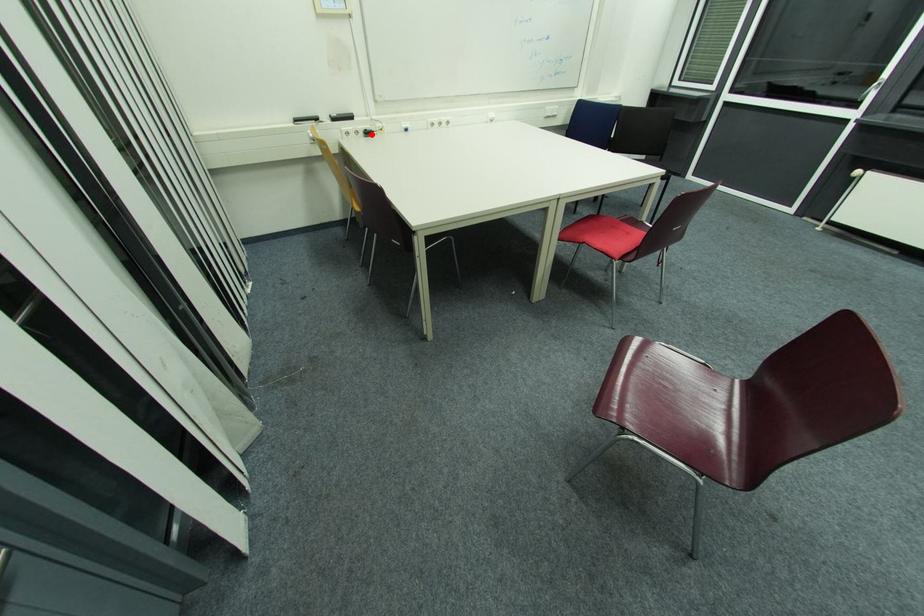
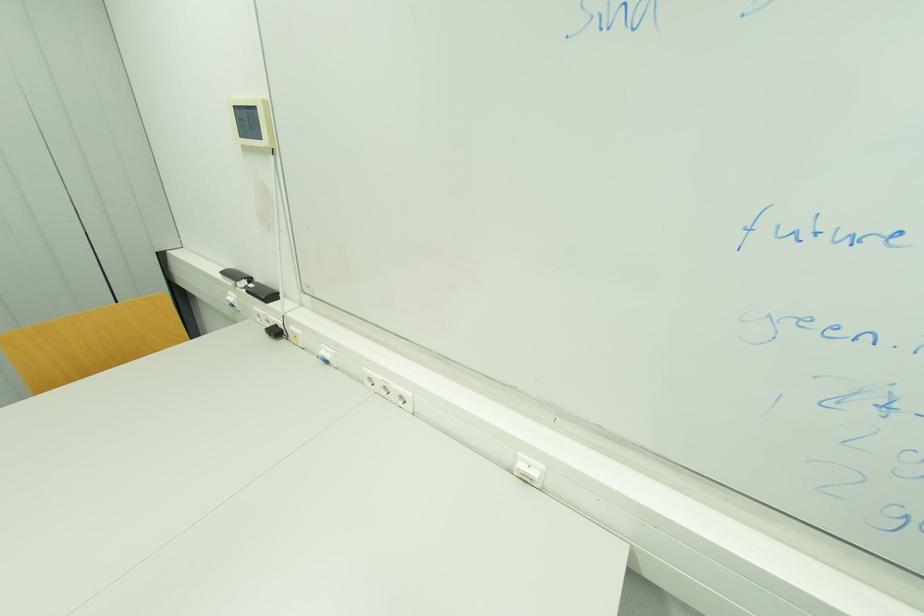
Where in the second image is the point corresponding to the highlighted location from the first image?

(281, 333)